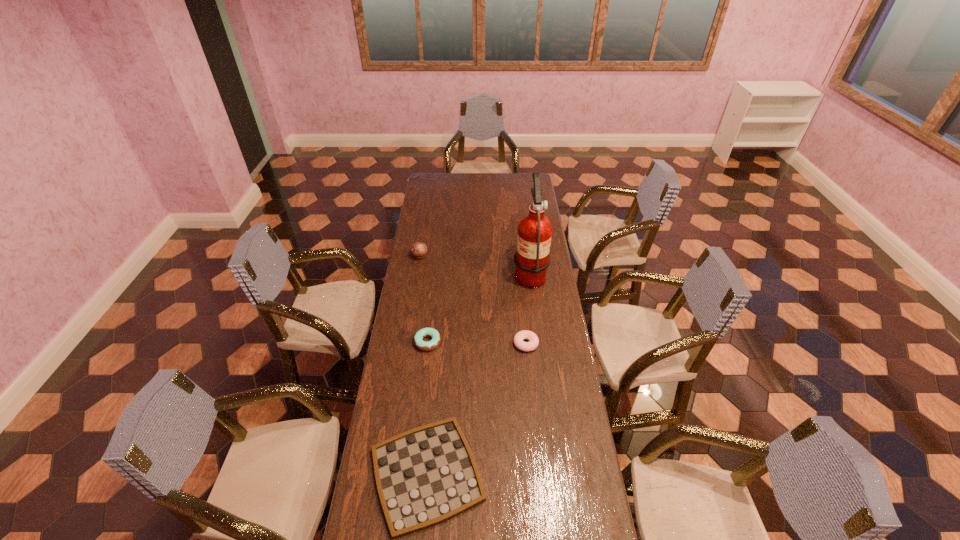
Where is `fire extinguisher`? fire extinguisher is located at coordinates (532, 258).

In order to click on the fourth shortest object in this screenshot , I will do `click(419, 250)`.

You are a GUI agent. You are given a task and a screenshot of the screen. Output one action in this format:
    pyautogui.click(x=<x>, y=<y>)
    Task: Click on the left doughnut
    The width and height of the screenshot is (960, 540).
    Given the screenshot: What is the action you would take?
    pyautogui.click(x=425, y=332)

At what (x,y) coordinates should I click in order to perform the action: click on the right doughnut. Please return your answer as a coordinate pair (x, y). Looking at the image, I should click on (518, 339).

The image size is (960, 540). I want to click on the nearest object, so click(425, 476).

The width and height of the screenshot is (960, 540). I want to click on checkerboard, so click(x=425, y=476).

You are a GUI agent. You are given a task and a screenshot of the screen. Output one action in this format:
    pyautogui.click(x=<x>, y=<y>)
    Task: Click on the free location located on the nozzle and handle of the tallest object
    
    Given the screenshot: What is the action you would take?
    pyautogui.click(x=494, y=273)

Locate an element on the screen. Image resolution: width=960 pixels, height=540 pixels. free region located on the nozzle and handle of the tallest object is located at coordinates (446, 273).

Where is `vacant space located 0.380m on the nozzle and handle of the tallest object`? The height and width of the screenshot is (540, 960). vacant space located 0.380m on the nozzle and handle of the tallest object is located at coordinates (437, 273).

You are a GUI agent. You are given a task and a screenshot of the screen. Output one action in this format:
    pyautogui.click(x=<x>, y=<y>)
    Task: Click on the free spot located 0.370m on the back of the muffin
    
    Given the screenshot: What is the action you would take?
    pyautogui.click(x=427, y=212)